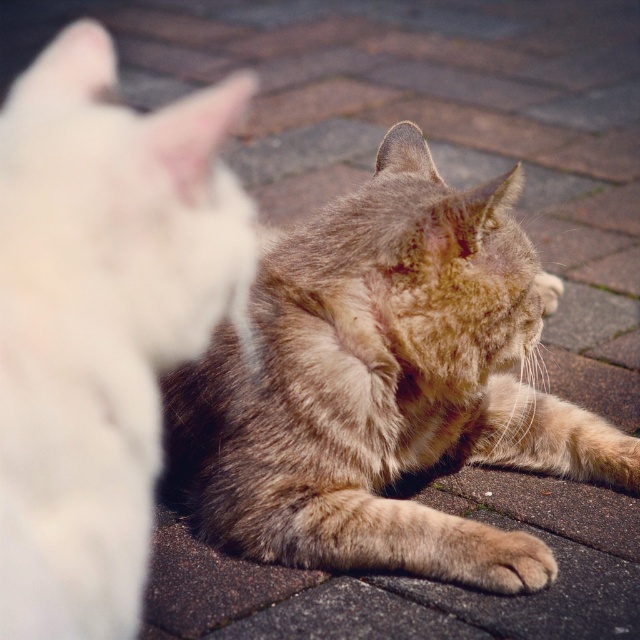
Question: Does tabby fur cat at center appear over soft fur paw at lower center?

Choices:
 (A) no
 (B) yes

Answer: (B)

Question: From the image, what is the correct spatial relationship of fluffy white cat at center in relation to soft fur paw at lower center?

Choices:
 (A) left
 (B) right

Answer: (A)

Question: Is tabby fur cat at center positioned in front of fluffy white cat at center?

Choices:
 (A) no
 (B) yes

Answer: (A)

Question: Which point is farther to the camera?

Choices:
 (A) (92, 100)
 (B) (241, 392)
 (C) (456, 572)

Answer: (B)

Question: Which point appears farthest from the camera in this image?

Choices:
 (A) (452, 560)
 (B) (132, 330)
 (C) (465, 275)

Answer: (C)

Question: Estimate the real-world distances between objects in this image. Which object is closer to the tabby fur cat at center?

Choices:
 (A) soft fur paw at lower center
 (B) fluffy white cat at center

Answer: (A)